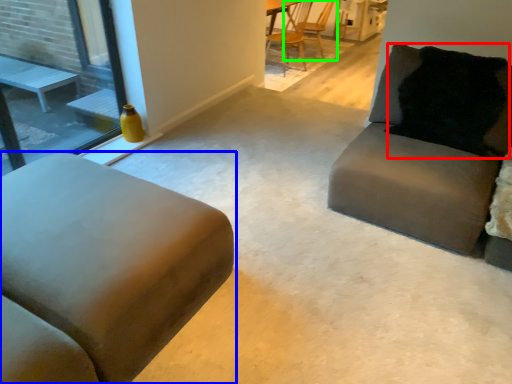
Question: Which object is positioned farthest from pillow (highlighted by a red box)? Select from studio couch (highlighted by a blue box) and chair (highlighted by a green box).

Choices:
 (A) studio couch
 (B) chair

Answer: (B)